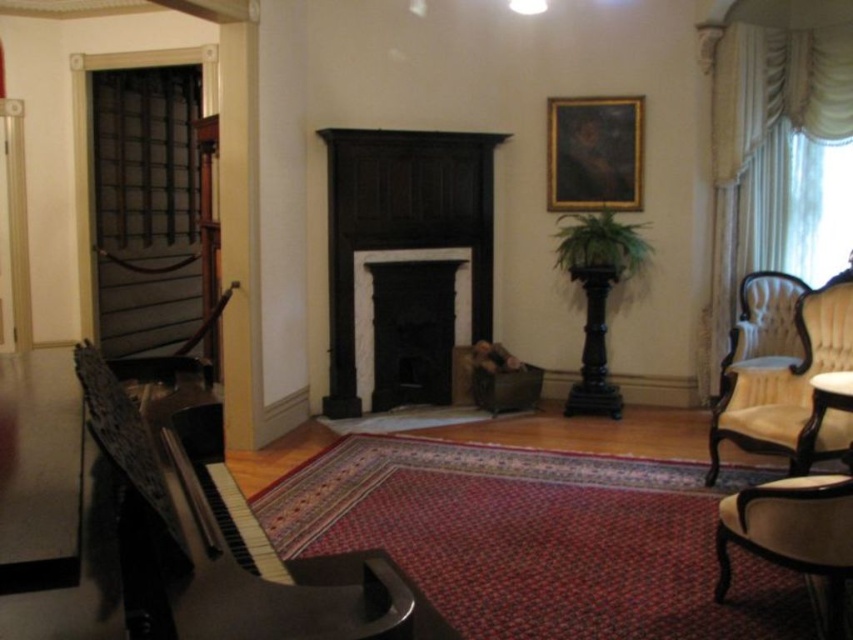
In the scene described, there is a velvet cream armchair at right and a black matte fireplace at center. From the perspective of someone standing in the room facing the fireplace, which object is located to the right?

The velvet cream armchair at right is located to the right of the black matte fireplace at center, so from the perspective of someone facing the fireplace, the velvet cream armchair at right would be to their right side.

You are standing in the center of the room. Which direction should you walk to reach the polished wood piano at left?

You should walk to the left to reach the polished wood piano at left since it is located at point (177,538), which is to the left side of the room.